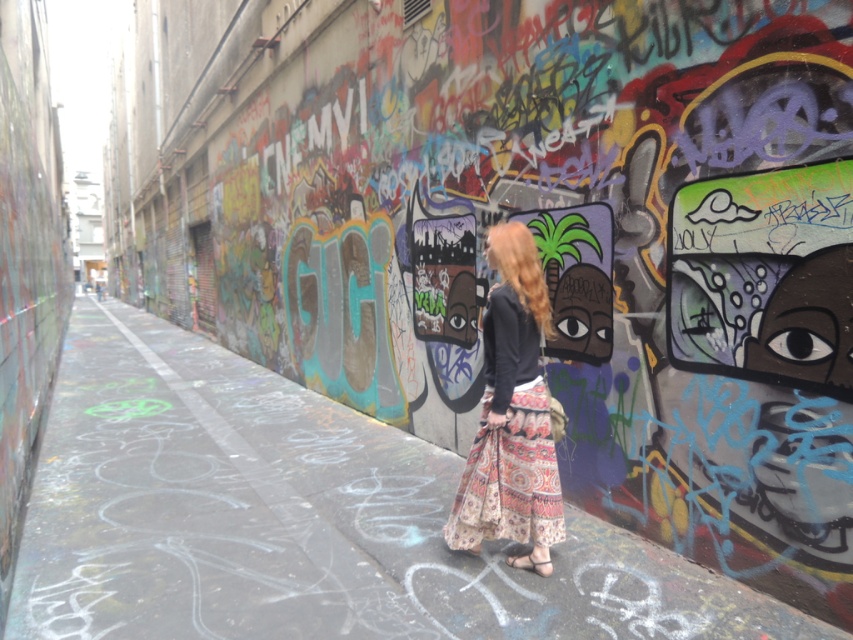
Question: Can you confirm if matte concrete alley at center is bigger than printed cotton skirt at center?

Choices:
 (A) no
 (B) yes

Answer: (B)

Question: Which point is farther to the camera?

Choices:
 (A) matte concrete alley at center
 (B) printed cotton skirt at center

Answer: (B)

Question: From the image, what is the correct spatial relationship of matte concrete alley at center in relation to printed cotton skirt at center?

Choices:
 (A) above
 (B) below

Answer: (B)

Question: Among these points, which one is farthest from the camera?

Choices:
 (A) (489, 388)
 (B) (436, 541)

Answer: (B)

Question: Is matte concrete alley at center above printed cotton skirt at center?

Choices:
 (A) yes
 (B) no

Answer: (B)